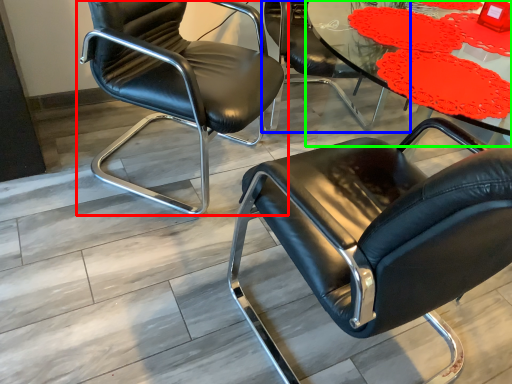
Question: Estimate the real-world distances between objects in this image. Which object is closer to chair (highlighted by a red box), chair (highlighted by a blue box) or table (highlighted by a green box)?

Choices:
 (A) chair
 (B) table

Answer: (A)